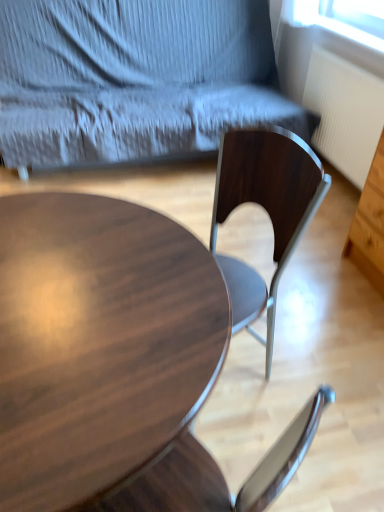
What do you see at coordinates (133, 79) in the screenshot? The width and height of the screenshot is (384, 512). I see `wooden chair at center` at bounding box center [133, 79].

Where is `shiny dark wood coffee table at center`? This screenshot has width=384, height=512. shiny dark wood coffee table at center is located at coordinates (97, 342).

Find the location of `wooden chair at center`. wooden chair at center is located at coordinates (133, 79).

Based on their positions, is wooden chair at center located to the left or right of white ribbed radiator at right?

From the image, it's evident that wooden chair at center is to the left of white ribbed radiator at right.

From the image's perspective, would you say wooden chair at center is shown under white ribbed radiator at right?

Actually, wooden chair at center appears above white ribbed radiator at right in the image.

Can you confirm if wooden chair at center is shorter than white ribbed radiator at right?

No.

Considering the sizes of objects wooden chair at center and white ribbed radiator at right in the image provided, who is smaller, wooden chair at center or white ribbed radiator at right?

white ribbed radiator at right is smaller.

Is wooden chair at center oriented away from shiny dark wood coffee table at center?

No, shiny dark wood coffee table at center is not at the back of wooden chair at center.

From the image's perspective, between wooden chair at center and shiny dark wood coffee table at center, who is located below?

shiny dark wood coffee table at center appears lower in the image.

Is wooden chair at center shorter than shiny dark wood coffee table at center?

In fact, wooden chair at center may be taller than shiny dark wood coffee table at center.

Is wooden chair at center to the right of shiny dark wood coffee table at center from the viewer's perspective?

Correct, you'll find wooden chair at center to the right of shiny dark wood coffee table at center.

Can you confirm if shiny dark wood coffee table at center is positioned to the left of wooden chair at center?

Indeed, shiny dark wood coffee table at center is positioned on the left side of wooden chair at center.

Is shiny dark wood coffee table at center turned away from wooden chair at center?

No.

Looking at this image, between shiny dark wood coffee table at center and wooden chair at center, which one has smaller size?

Smaller between the two is shiny dark wood coffee table at center.

From a real-world perspective, which is physically below, white ribbed radiator at right or wooden chair at center?

In real-world perspective, white ribbed radiator at right is lower.

Is white ribbed radiator at right oriented away from wooden chair at center?

No, white ribbed radiator at right is not facing the opposite direction of wooden chair at center.

Who is taller, white ribbed radiator at right or wooden chair at center?

Standing taller between the two is wooden chair at center.

Which of these two, white ribbed radiator at right or wooden chair at center, is bigger?

With larger size is wooden chair at center.

Considering the sizes of objects white ribbed radiator at right and shiny dark wood coffee table at center in the image provided, who is wider, white ribbed radiator at right or shiny dark wood coffee table at center?

With larger width is shiny dark wood coffee table at center.

Would you say white ribbed radiator at right contains shiny dark wood coffee table at center?

That's incorrect, shiny dark wood coffee table at center is not inside white ribbed radiator at right.

Is point (357, 91) positioned before point (148, 446)?

That is False.

Which of these two, shiny dark wood coffee table at center or white ribbed radiator at right, is thinner?

white ribbed radiator at right is thinner.

Considering the sizes of shiny dark wood coffee table at center and white ribbed radiator at right in the image, is shiny dark wood coffee table at center bigger or smaller than white ribbed radiator at right?

Clearly, shiny dark wood coffee table at center is larger in size than white ribbed radiator at right.

Which is more to the right, shiny dark wood coffee table at center or white ribbed radiator at right?

white ribbed radiator at right is more to the right.

Find the location of a particular element. radiator behind the wooden chair at center is located at coordinates (344, 113).

Image resolution: width=384 pixels, height=512 pixels. What are the coordinates of `chair above the shiny dark wood coffee table at center (from a real-world perspective)` in the screenshot? It's located at (133, 79).

Estimate the real-world distances between objects in this image. Which object is further from wooden chair at center, shiny dark wood coffee table at center or white ribbed radiator at right?

shiny dark wood coffee table at center.

Which object lies nearer to the anchor point white ribbed radiator at right, shiny dark wood coffee table at center or wooden chair at center?

The object closer to white ribbed radiator at right is wooden chair at center.

From the image, which object appears to be nearer to shiny dark wood coffee table at center, wooden chair at center or white ribbed radiator at right?

Based on the image, wooden chair at center appears to be nearer to shiny dark wood coffee table at center.

Considering their positions, is wooden chair at center positioned further to white ribbed radiator at right than shiny dark wood coffee table at center?

shiny dark wood coffee table at center is further to white ribbed radiator at right.

From the image, which object appears to be farther from shiny dark wood coffee table at center, white ribbed radiator at right or wooden chair at center?

white ribbed radiator at right lies further to shiny dark wood coffee table at center than the other object.

Based on their spatial positions, is white ribbed radiator at right or shiny dark wood coffee table at center closer to wooden chair at center?

Based on the image, white ribbed radiator at right appears to be nearer to wooden chair at center.

At what (x,y) coordinates should I click in order to perform the action: click on chair between shiny dark wood coffee table at center and white ribbed radiator at right in the front-back direction. Please return your answer as a coordinate pair (x, y). Looking at the image, I should click on (133, 79).